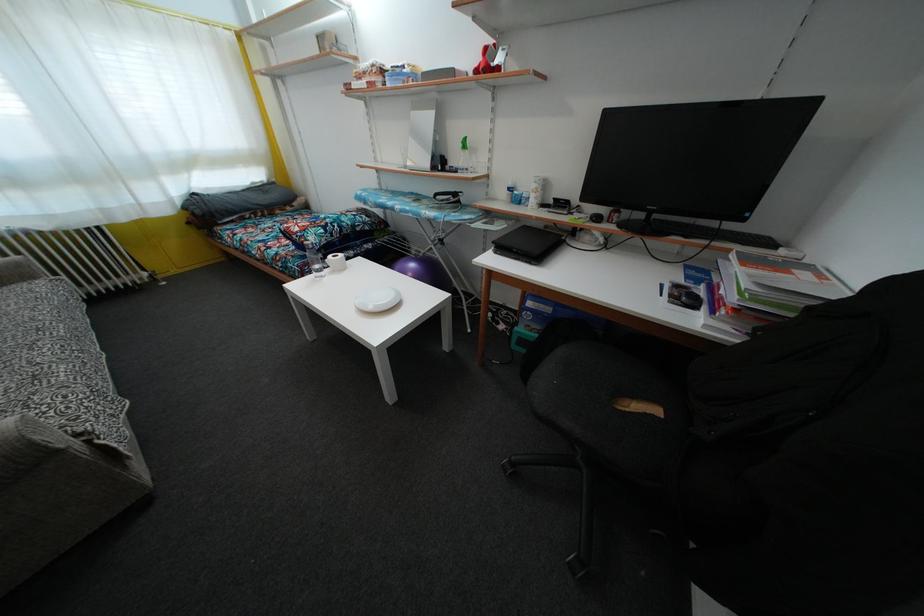
Find the location of a particular element. green spray bottle is located at coordinates (464, 156).